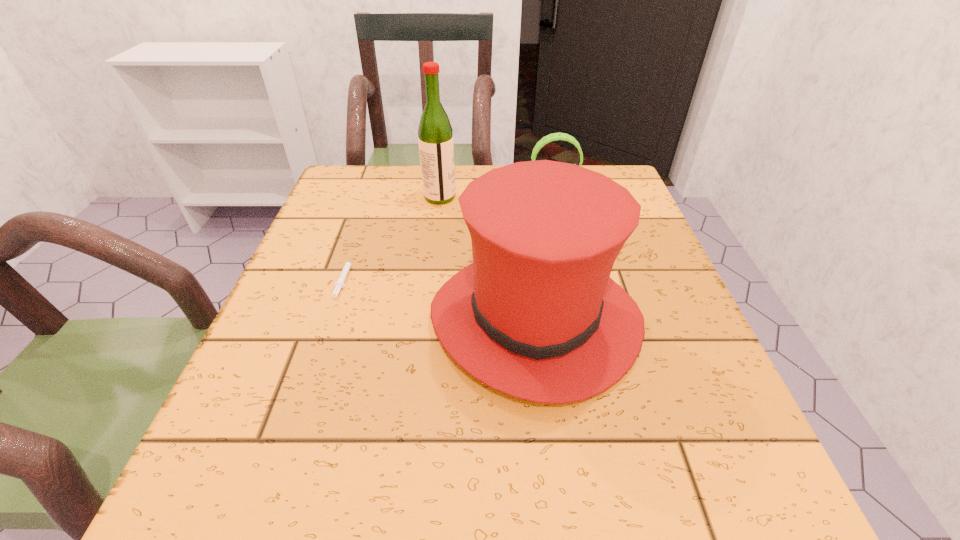
Identify the location of headset located at the far edge. (553, 137).

Find the location of `object at the left edge`. object at the left edge is located at coordinates (339, 284).

Find the location of a particular element. hat located at the right edge is located at coordinates (536, 316).

The width and height of the screenshot is (960, 540). What are the coordinates of `headset that is at the right edge` in the screenshot? It's located at (553, 137).

Where is `object present at the far right corner`? This screenshot has height=540, width=960. object present at the far right corner is located at coordinates (553, 137).

Find the location of a particular element. vacant space at the far edge is located at coordinates (399, 199).

Find the location of `free region at the near edge of the desktop`. free region at the near edge of the desktop is located at coordinates (323, 484).

What are the coordinates of `vacant space at the left edge of the desktop` in the screenshot? It's located at (277, 354).

Where is `vacant space at the right edge of the desktop`? vacant space at the right edge of the desktop is located at coordinates (682, 384).

At what (x,y) coordinates should I click in order to perform the action: click on vacant space at the far left corner of the desktop. Please return your answer as a coordinate pair (x, y). The width and height of the screenshot is (960, 540). Looking at the image, I should click on (384, 195).